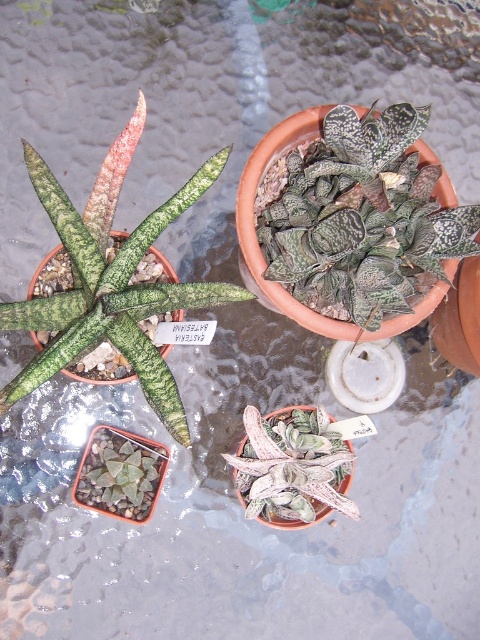
Does white textured leaf at center have a larger size compared to green textured succulent at lower left?

Indeed, white textured leaf at center has a larger size compared to green textured succulent at lower left.

Is white textured leaf at center smaller than green textured succulent at lower left?

Incorrect, white textured leaf at center is not smaller in size than green textured succulent at lower left.

Does point (245, 433) lie behind point (120, 490)?

Yes, point (245, 433) is behind point (120, 490).

Find the location of `white textured leaf at center`. white textured leaf at center is located at coordinates (288, 472).

Between point (127, 253) and point (230, 464), which one is positioned behind?

Positioned behind is point (230, 464).

Find the location of `green textured leaves at left`. green textured leaves at left is located at coordinates (110, 280).

Is the position of textured terracotta pot at upper center more distant than that of white textured leaf at center?

No, it is not.

Which is behind, point (376, 204) or point (249, 506)?

The point (249, 506) is behind.

In order to click on textured terracotta pot at upper center in this screenshot , I will do point(360,218).